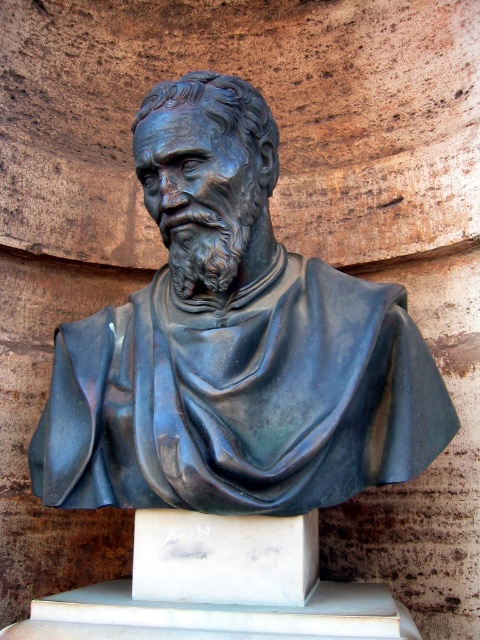
Question: Is bronze statue at center further to camera compared to white marble pedestal at center?

Choices:
 (A) yes
 (B) no

Answer: (B)

Question: Can you confirm if bronze statue at center is positioned to the left of white marble pedestal at center?

Choices:
 (A) no
 (B) yes

Answer: (B)

Question: Which point appears farthest from the camera in this image?

Choices:
 (A) coord(141,600)
 (B) coord(262,182)

Answer: (B)

Question: Does bronze statue at center appear on the left side of white marble pedestal at center?

Choices:
 (A) yes
 (B) no

Answer: (A)

Question: Which object is farther from the camera taking this photo?

Choices:
 (A) bronze statue at center
 (B) white marble pedestal at center

Answer: (B)